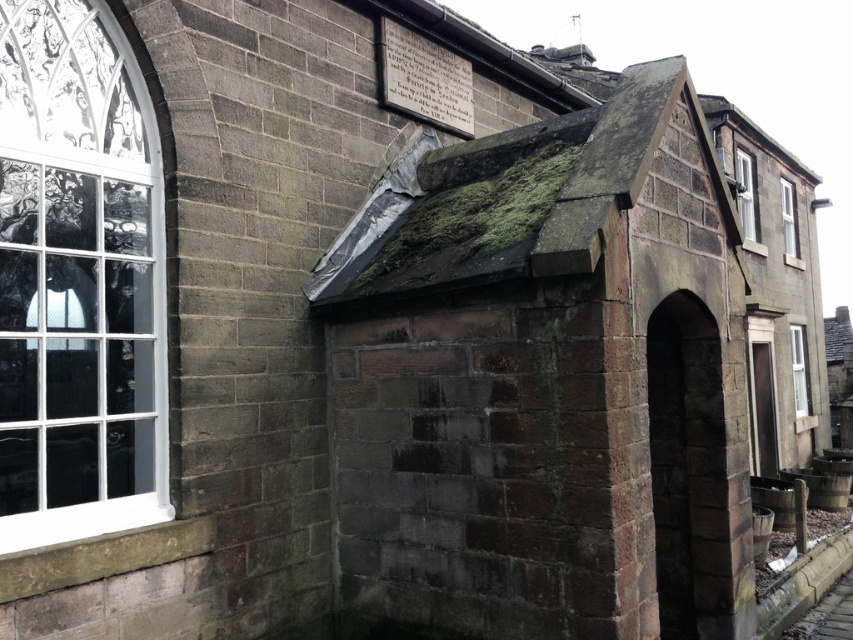
Question: Which of the following is the farthest from the observer?

Choices:
 (A) white wooden window at upper right
 (B) white glass window at left
 (C) green mossy roof at upper center
 (D) white plastic window at right

Answer: (D)

Question: Does white glass window at left have a lesser width compared to white wooden window at upper right?

Choices:
 (A) yes
 (B) no

Answer: (A)

Question: Considering the relative positions of white glass window at left and clear glass window at upper right in the image provided, where is white glass window at left located with respect to clear glass window at upper right?

Choices:
 (A) left
 (B) right

Answer: (A)

Question: Which of the following is the farthest from the observer?

Choices:
 (A) (425, 275)
 (B) (51, 296)
 (C) (781, 184)
 (D) (798, 381)

Answer: (C)

Question: Is white glass window at left to the right of green mossy roof at upper center from the viewer's perspective?

Choices:
 (A) no
 (B) yes

Answer: (A)

Question: Which object appears closest to the camera in this image?

Choices:
 (A) white plastic window at right
 (B) green mossy roof at upper center

Answer: (B)